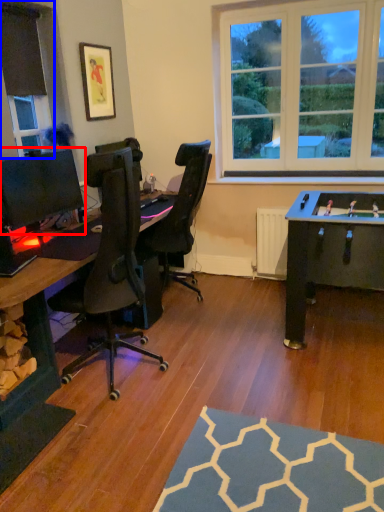
Question: Which of the following is the farthest to the observer, computer monitor (highlighted by a red box) or window frame (highlighted by a blue box)?

Choices:
 (A) computer monitor
 (B) window frame

Answer: (B)